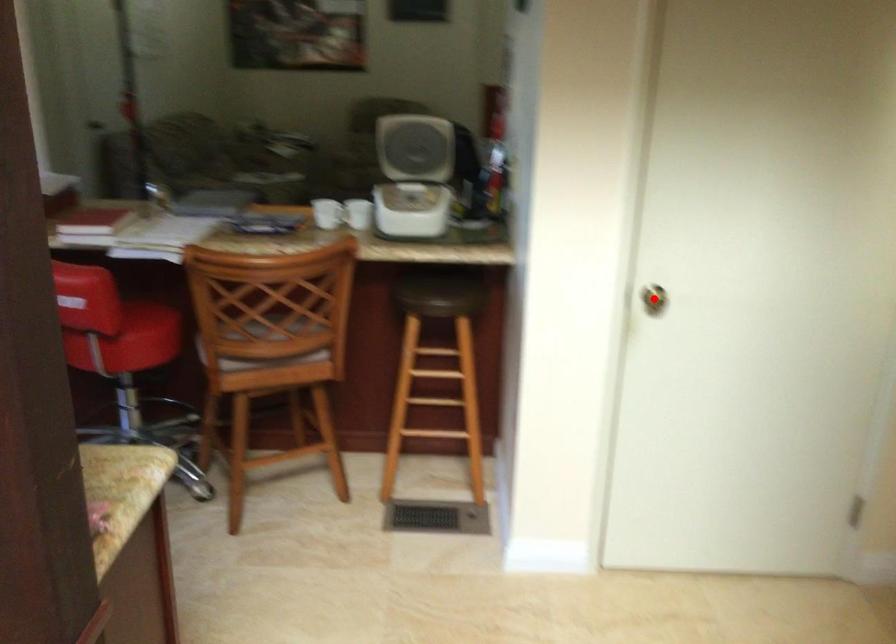
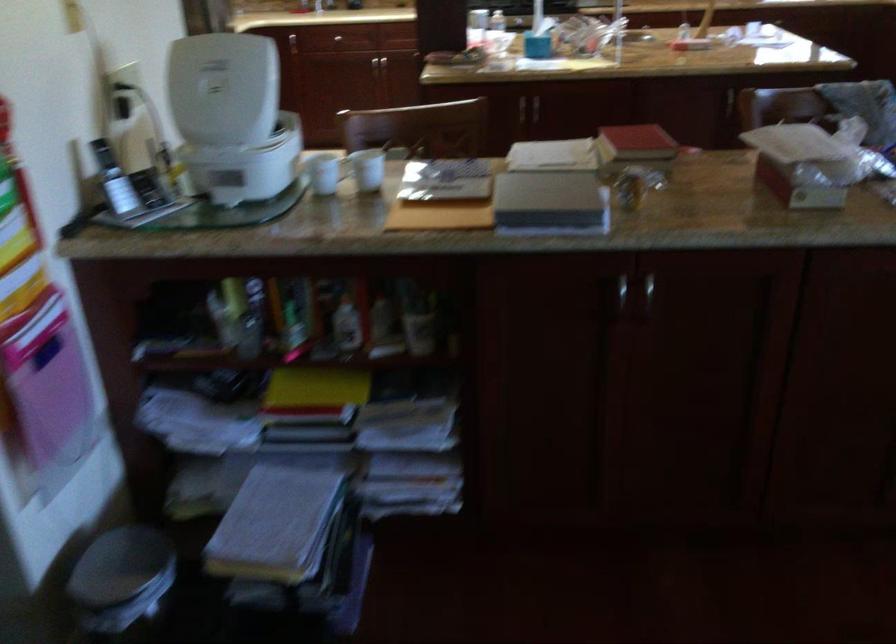
Question: I am providing you with two images of the same scene from different viewpoints. A red point is marked on the first image. At the location where the point appears in image 1, is it still visible in image 2?

Choices:
 (A) Yes
 (B) No

Answer: (B)